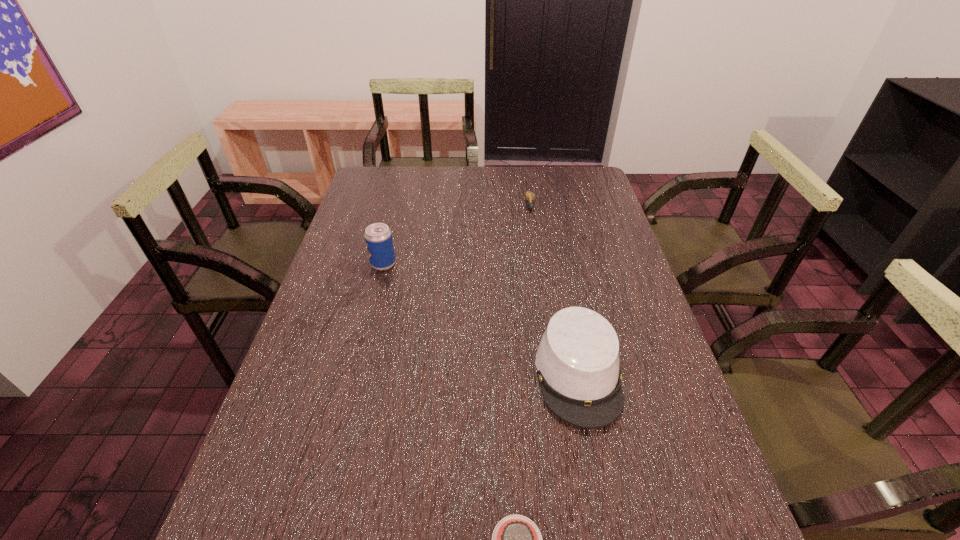
Point out which object is positioned as the third nearest to the beer can. Please provide its 2D coordinates. Your answer should be formatted as a tuple, i.e. [(x, y)], where the tuple contains the x and y coordinates of a point satisfying the conditions above.

[(516, 539)]

The image size is (960, 540). In order to click on object that is the third closest to the tallest object in this screenshot , I will do `click(516, 539)`.